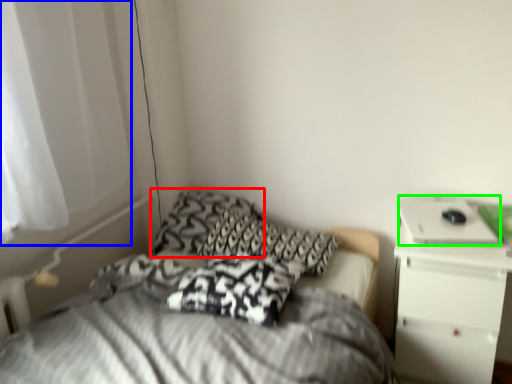
Question: Which is farther away from pillow (highlighted by a red box)? curtain (highlighted by a blue box) or laptop (highlighted by a green box)?

Choices:
 (A) curtain
 (B) laptop

Answer: (B)